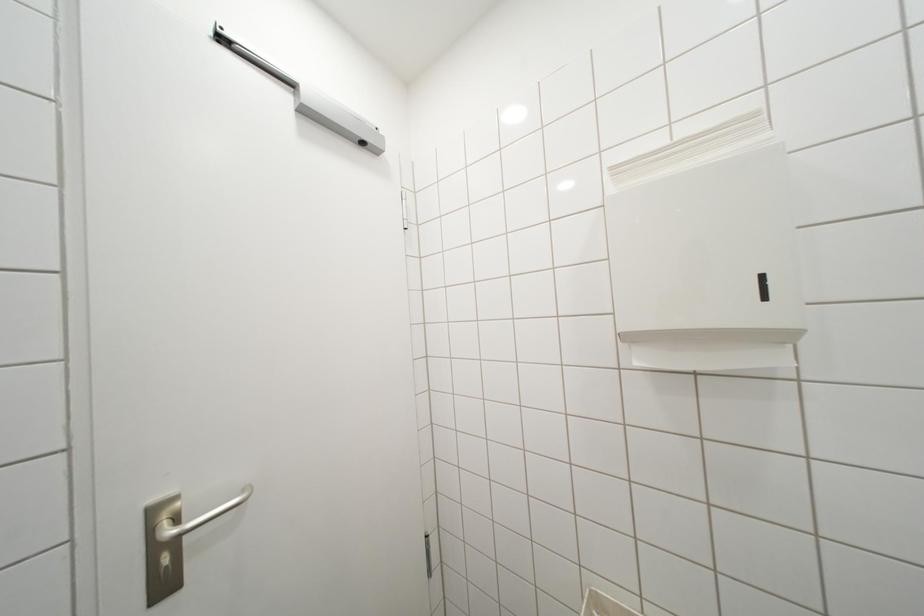
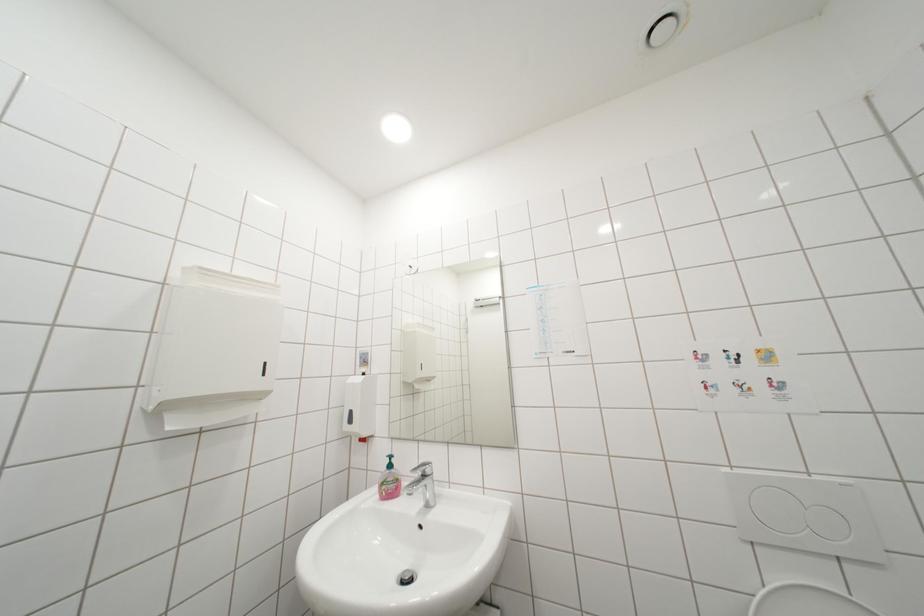
First-person continuous shooting, in which direction is the camera rotating?

The camera's rotation is toward right-up.